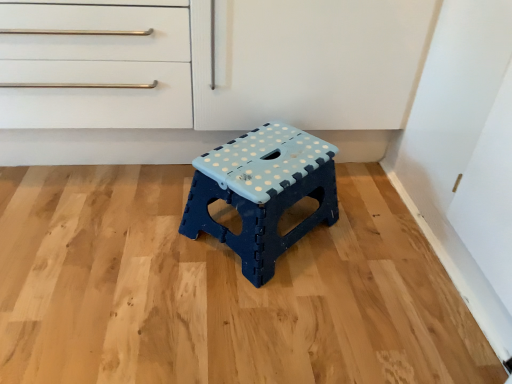
Question: In the image, is light brown wood at center on the left side or the right side of blue plastic stool at center?

Choices:
 (A) right
 (B) left

Answer: (B)

Question: From the image's perspective, is light brown wood at center located above or below blue plastic stool at center?

Choices:
 (A) below
 (B) above

Answer: (A)

Question: Considering the positions of light brown wood at center and blue plastic stool at center in the image, is light brown wood at center bigger or smaller than blue plastic stool at center?

Choices:
 (A) small
 (B) big

Answer: (B)

Question: From the image's perspective, is blue plastic stool at center positioned above or below light brown wood at center?

Choices:
 (A) above
 (B) below

Answer: (A)

Question: Considering the positions of blue plastic stool at center and light brown wood at center in the image, is blue plastic stool at center wider or thinner than light brown wood at center?

Choices:
 (A) wide
 (B) thin

Answer: (B)

Question: In terms of height, does blue plastic stool at center look taller or shorter compared to light brown wood at center?

Choices:
 (A) short
 (B) tall

Answer: (B)

Question: Is blue plastic stool at center in front of or behind light brown wood at center in the image?

Choices:
 (A) behind
 (B) front

Answer: (A)